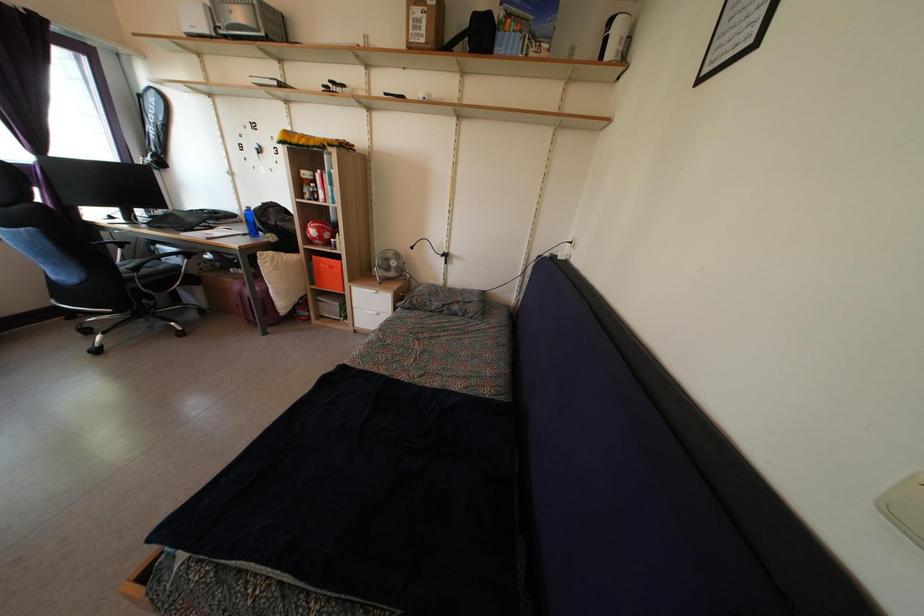
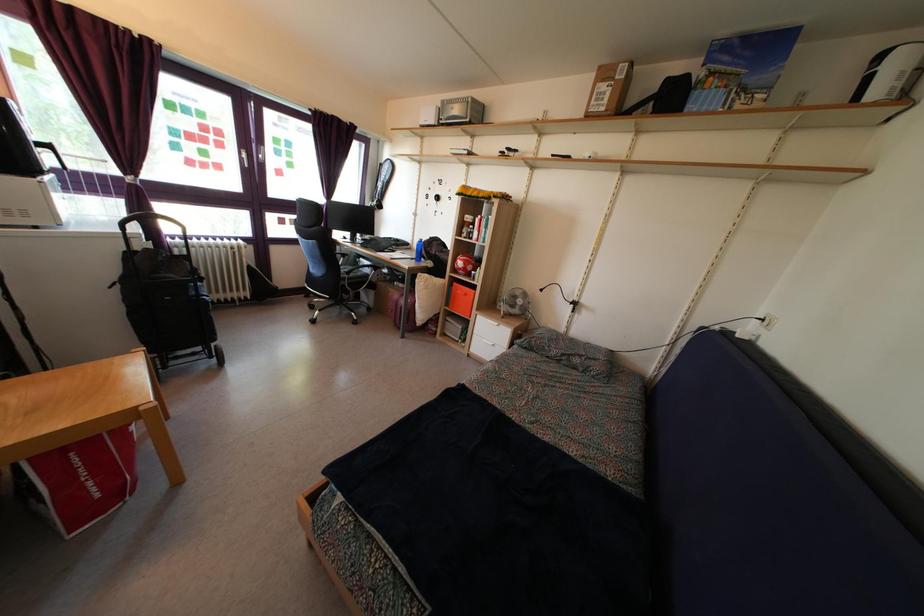
In the second image, find the point that corresponds to [309,183] in the first image.

(470, 227)